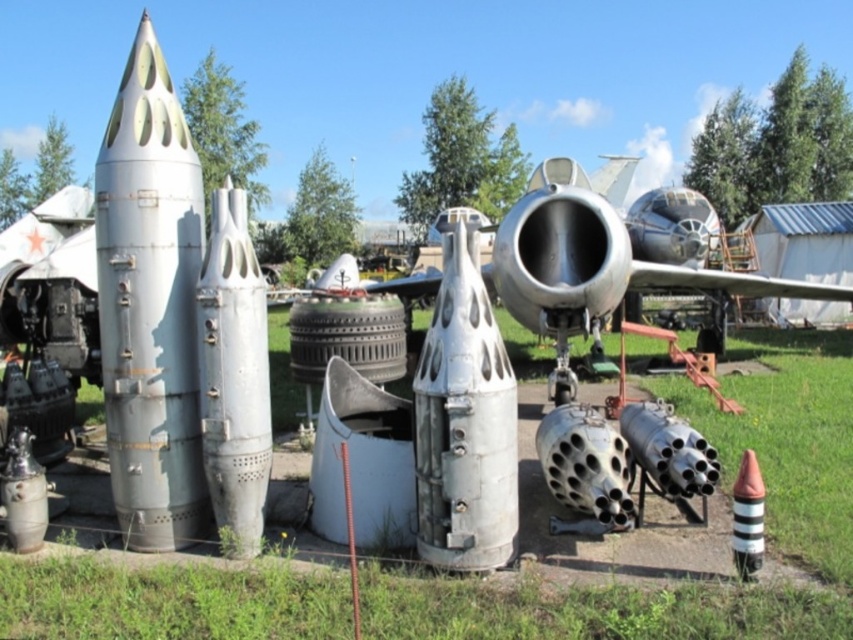
You are standing in front of the aviation artifacts display. There are two points marked in the image. The first point is at coordinate point(738, 625) and the second is at point(732, 557). Which point is closer to you?

Point(738, 625) is closer to the camera than point(732, 557).

You are a visitor at the aviation museum and want to take a photo of the green grass at center and the striped plastic cone at lower right. To ensure both are visible in the frame, which object should be closer to the camera?

The green grass at center is in front of the striped plastic cone at lower right, so to have both visible in the frame, the green grass at center should be closer to the camera.